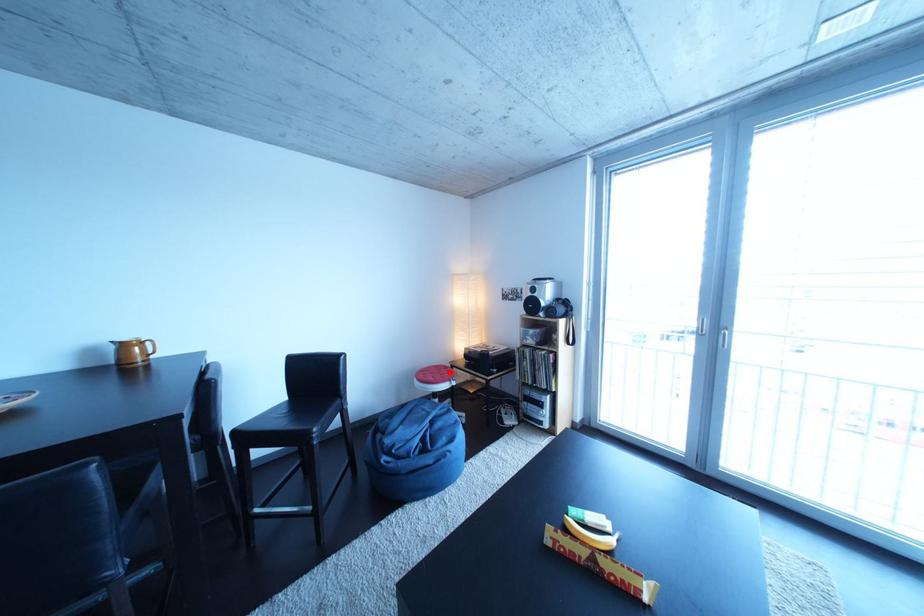
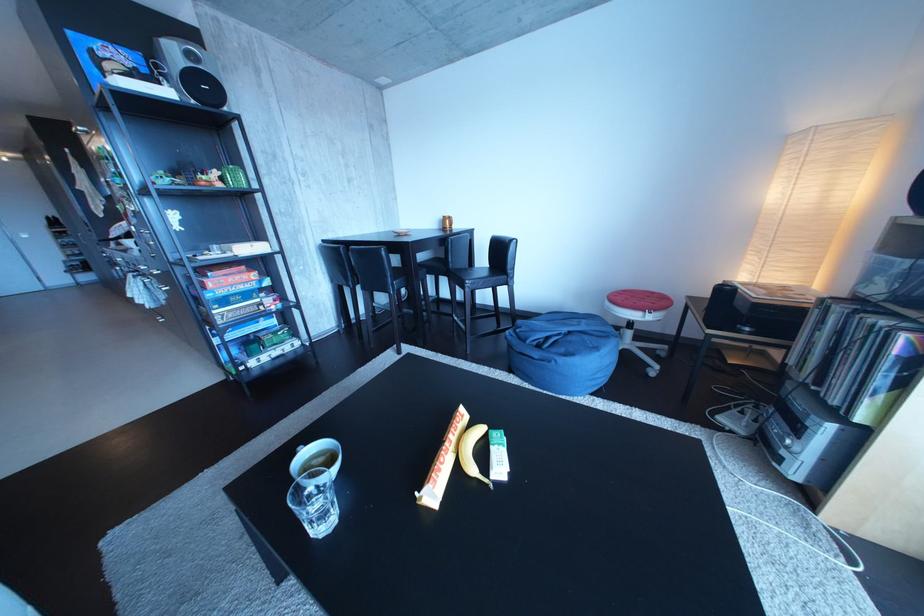
Question: I am providing you with two images of the same scene from different viewpoints. A red point is marked on the first image. Can you still see the location of the red point in image 2?

Choices:
 (A) Yes
 (B) No

Answer: (A)